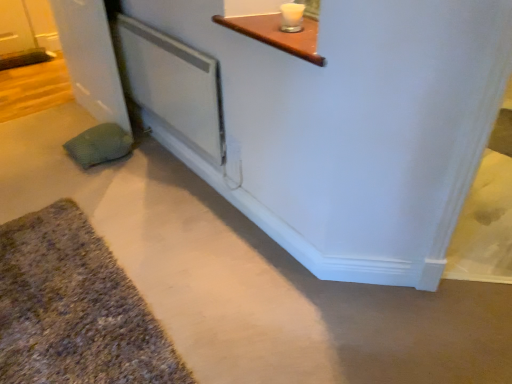
Question: Are textured gray bath mat at lower left and green textured pillow at lower left beside each other?

Choices:
 (A) yes
 (B) no

Answer: (B)

Question: Is textured gray bath mat at lower left looking in the opposite direction of green textured pillow at lower left?

Choices:
 (A) yes
 (B) no

Answer: (B)

Question: Is textured gray bath mat at lower left smaller than green textured pillow at lower left?

Choices:
 (A) no
 (B) yes

Answer: (A)

Question: Is textured gray bath mat at lower left to the left of green textured pillow at lower left from the viewer's perspective?

Choices:
 (A) yes
 (B) no

Answer: (B)

Question: From the image's perspective, is textured gray bath mat at lower left above green textured pillow at lower left?

Choices:
 (A) no
 (B) yes

Answer: (A)

Question: Would you say white glossy door at left is inside or outside textured gray bath mat at lower left?

Choices:
 (A) outside
 (B) inside

Answer: (A)

Question: From a real-world perspective, is white glossy door at left positioned above or below textured gray bath mat at lower left?

Choices:
 (A) below
 (B) above

Answer: (B)

Question: In the image, is white glossy door at left positioned in front of or behind textured gray bath mat at lower left?

Choices:
 (A) behind
 (B) front

Answer: (A)

Question: In the image, is white glossy door at left on the left side or the right side of textured gray bath mat at lower left?

Choices:
 (A) right
 (B) left

Answer: (B)

Question: From their relative heights in the image, would you say white plastic screen door at center is taller or shorter than white glossy door at left?

Choices:
 (A) short
 (B) tall

Answer: (A)

Question: From the image's perspective, relative to white glossy door at left, is white plastic screen door at center above or below?

Choices:
 (A) below
 (B) above

Answer: (A)

Question: Looking at the image, does white plastic screen door at center seem bigger or smaller compared to white glossy door at left?

Choices:
 (A) small
 (B) big

Answer: (A)

Question: From a real-world perspective, is white plastic screen door at center above or below white glossy door at left?

Choices:
 (A) above
 (B) below

Answer: (A)

Question: Looking at their shapes, would you say white plastic screen door at center is wider or thinner than textured gray bath mat at lower left?

Choices:
 (A) wide
 (B) thin

Answer: (B)

Question: Is white plastic screen door at center taller or shorter than textured gray bath mat at lower left?

Choices:
 (A) short
 (B) tall

Answer: (B)